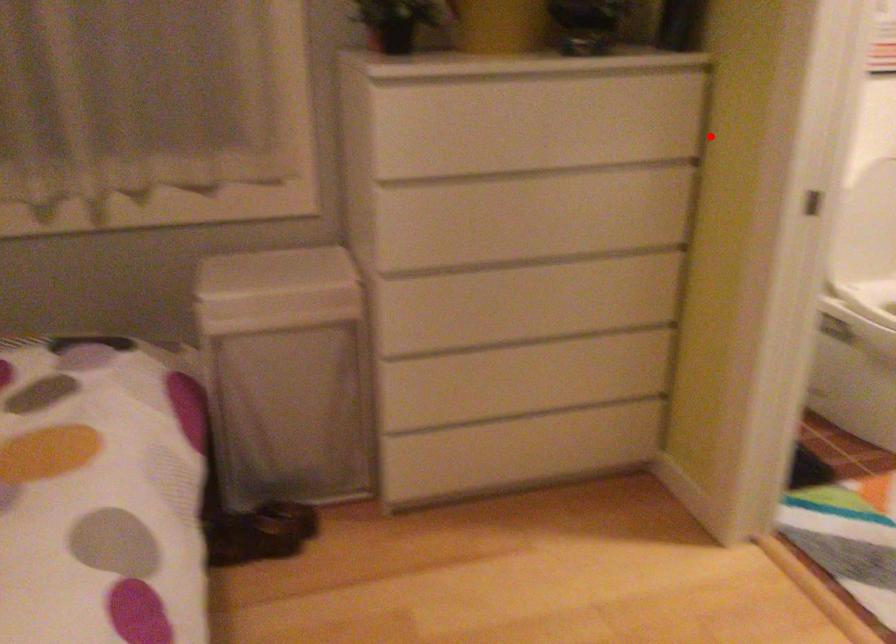
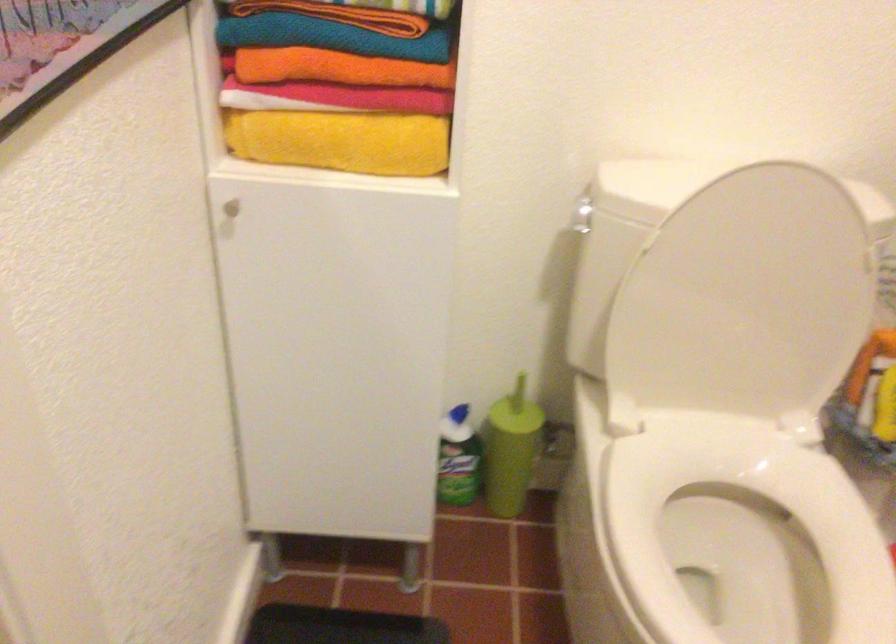
The point at the highlighted location is marked in the first image. Where is the corresponding point in the second image?

(331, 37)